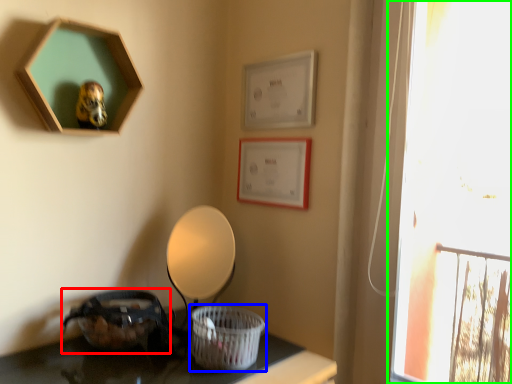
Question: Based on their relative distances, which object is farther from basket (highlighted by a red box)? Choose from basket (highlighted by a blue box) and window (highlighted by a green box).

Choices:
 (A) basket
 (B) window

Answer: (B)